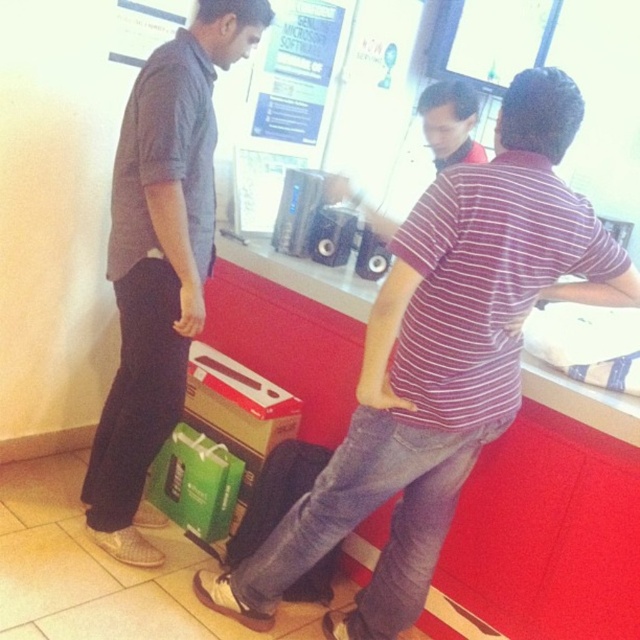
Who is taller, striped cotton shirt at center or dark gray shirt at left?

With more height is dark gray shirt at left.

Is the position of striped cotton shirt at center less distant than that of dark gray shirt at left?

Yes, striped cotton shirt at center is closer to the viewer.

This screenshot has height=640, width=640. Describe the element at coordinates (442, 362) in the screenshot. I see `striped cotton shirt at center` at that location.

Identify the location of striped cotton shirt at center. The height and width of the screenshot is (640, 640). (442, 362).